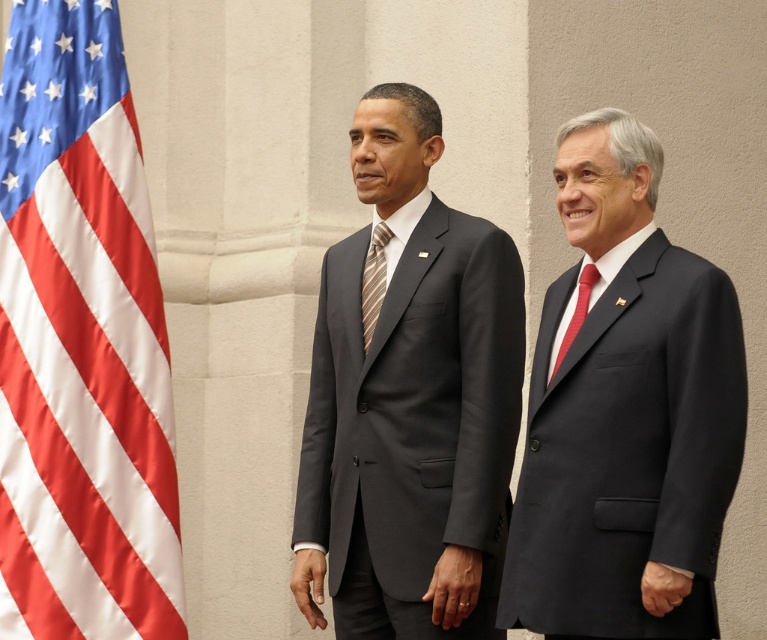
Based on the scene description, where is the satin fabric flag at left located in terms of coordinates?

The satin fabric flag at left is located at point (x=81, y=342).

You are a photographer setting up for a formal event. You notice the satin fabric flag at left and the red silk tie at right in the frame. Which object is taller in the image?

The satin fabric flag at left is taller than the red silk tie at right.

You are attending a formal event and need to determine the spatial arrangement of the items in the scene. Which object is located to the left of the other between the satin fabric flag at left and the red silk tie at right?

The satin fabric flag at left is positioned on the left side of the red silk tie at right, so the flag is to the left of the tie.